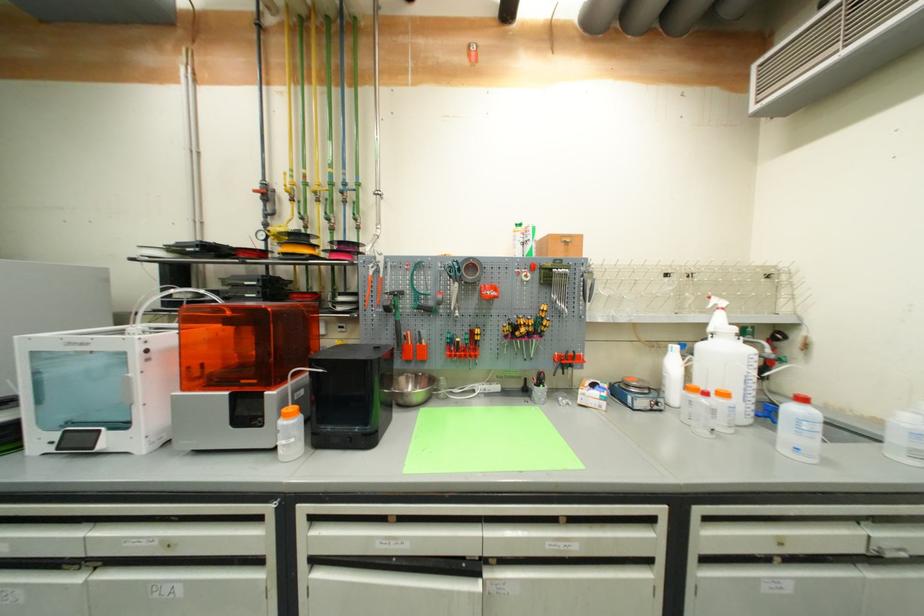
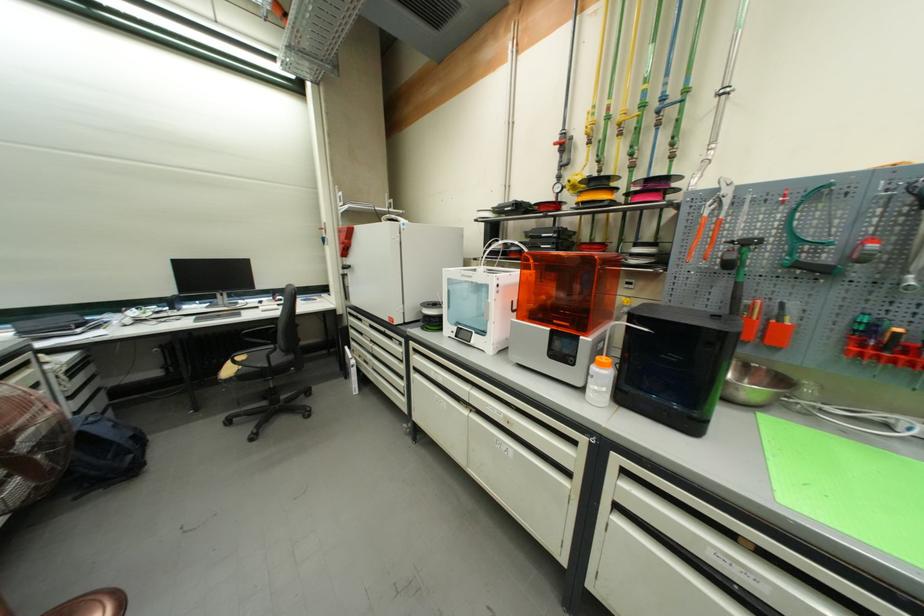
In the second image, find the point that corresponds to (x=294, y=418) in the first image.

(606, 367)